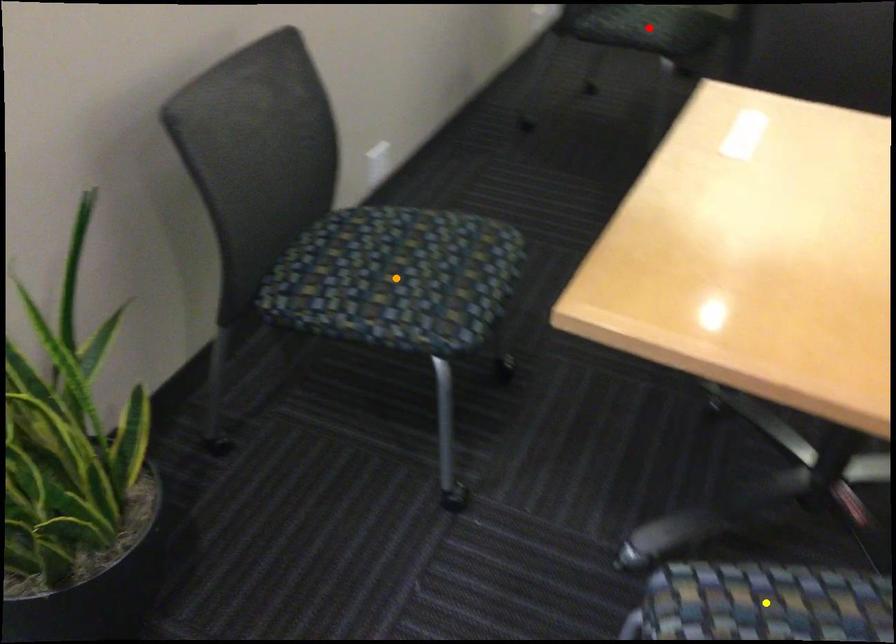
In the scene shown: Order these from farthest to nearest:
1. red point
2. orange point
3. yellow point

red point
orange point
yellow point